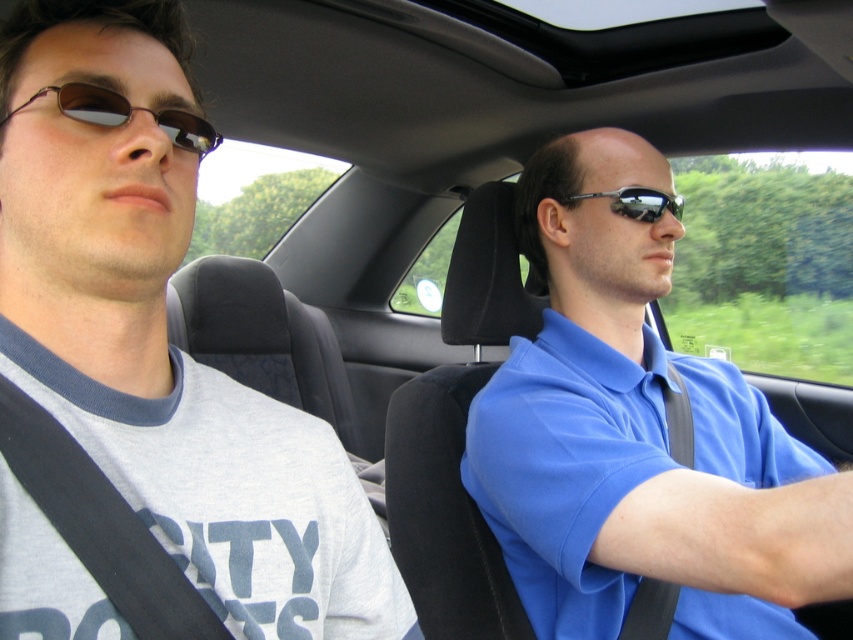
You are a delivery robot that needs to place a package on the car seat. The package requires a flat surface at least 1.2 meters away from the camera to avoid blocking the driver. Can you place the package at point (573, 557)?

The distance between point (573, 557) and the camera is 1.10 meters, which is less than the required 1.2 meters. Therefore, placing the package there would block the driver, so it is not possible.

You are a passenger in the car and want to hand a snack to the driver. The snack is currently on the dashboard. Which object, the blue cotton shirt at center or the matte brown sunglasses at left, is closer to you so you can reach it first?

The blue cotton shirt at center is closer to you than the matte brown sunglasses at left, so you can reach it first.

You are a passenger in the car and want to hand the shiny black sunglasses at center to the person wearing the matte brown sunglasses at left. Can you reach them directly without moving your seat?

The matte brown sunglasses at left is in front of the shiny black sunglasses at center, so the distance between them is too close for the passenger to reach directly without moving their seat.